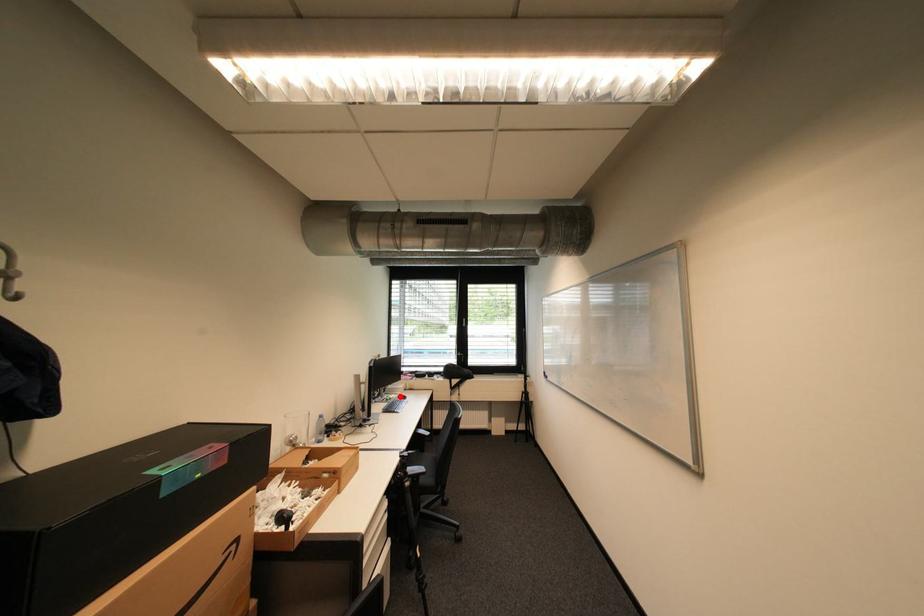
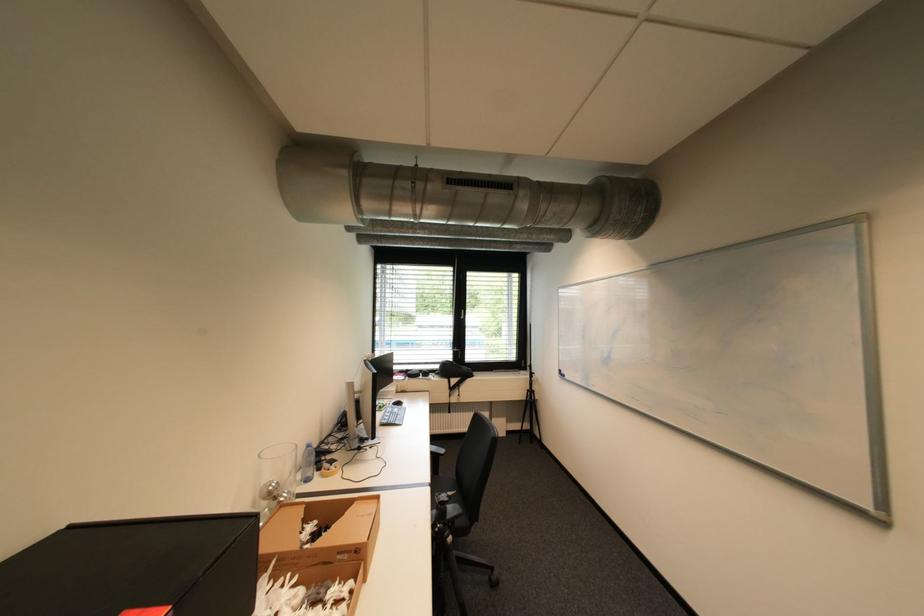
The point at the highlighted location is marked in the first image. Where is the corresponding point in the second image?

(393, 403)